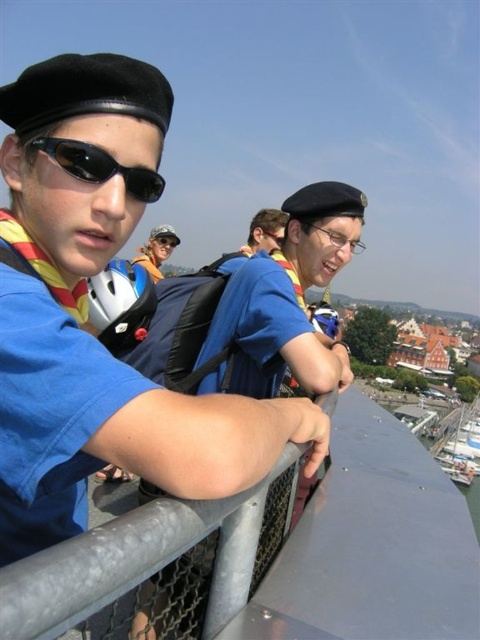
Consider the image. Is matte blue shirt at center positioned at the back of brushed metal goggles at center?

No, matte blue shirt at center is closer to the viewer.

Does matte blue shirt at center appear on the right side of brushed metal goggles at center?

Correct, you'll find matte blue shirt at center to the right of brushed metal goggles at center.

Which is behind, point (264, 243) or point (178, 243)?

Positioned behind is point (178, 243).

In order to click on matte blue shirt at center in this screenshot , I will do `click(264, 230)`.

Is white matte bicycle helmet at center behind transparent plastic goggles at center?

No.

Is point (137, 339) closer to camera compared to point (334, 234)?

Yes, it is.

Find the location of `white matte bicycle helmet at center`. white matte bicycle helmet at center is located at coordinates (121, 298).

Is point (264, 234) in front of point (140, 252)?

Yes, it is.

Locate an element on the screen. matte blue shirt at center is located at coordinates (264, 230).